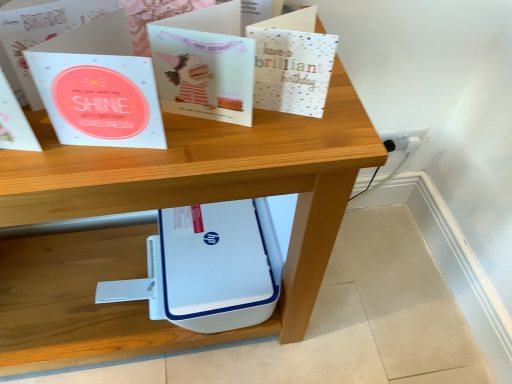
Locate an element on the screen. vacant region to the right of white plastic printer at center is located at coordinates (371, 305).